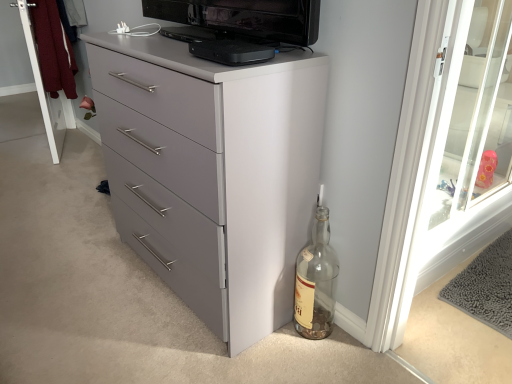
What are the coordinates of `free space in front of white wood screen door at upper left, which is counted as the second screen door, starting from the right` in the screenshot? It's located at (51, 166).